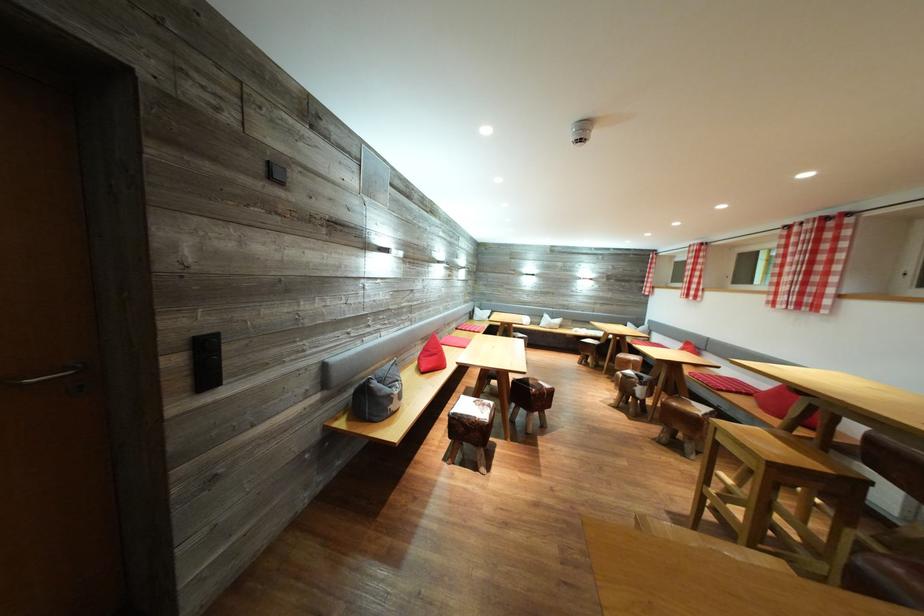
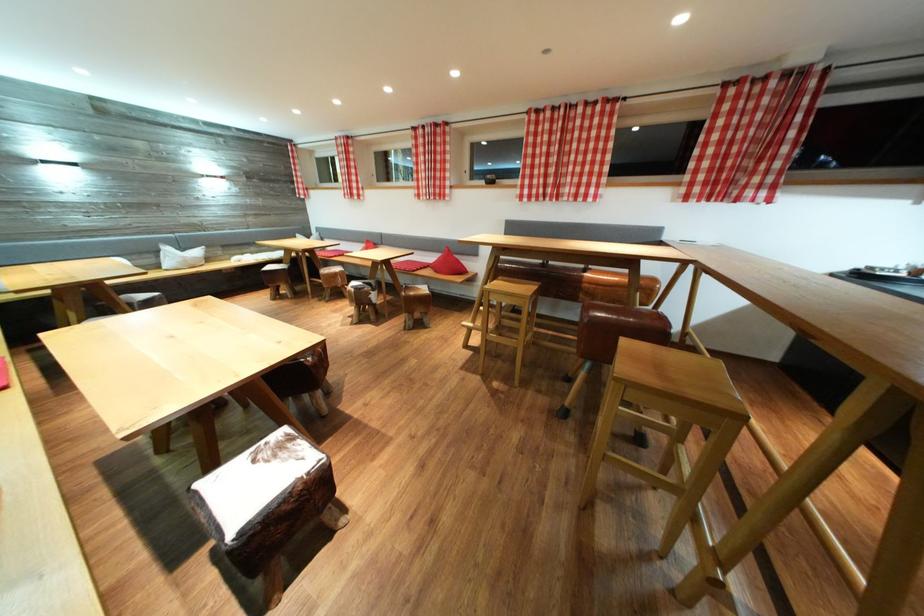
In the second image, find the point that corresponds to the point at 543,322 in the first image.

(151, 259)